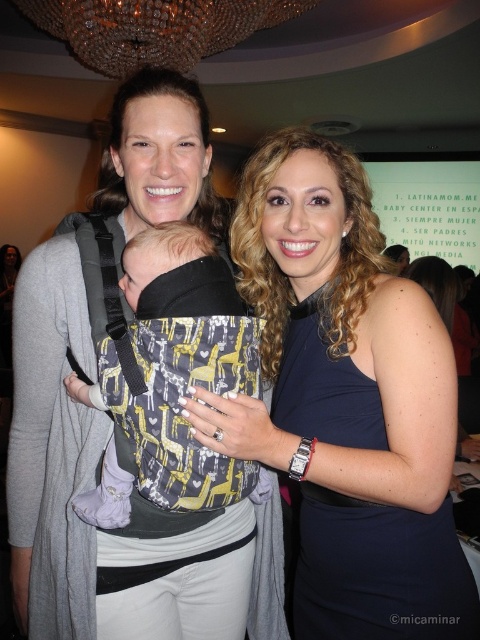
Can you confirm if matte black baby carrier at center is bigger than printed fabric baby carrier at center?

Yes, matte black baby carrier at center is bigger than printed fabric baby carrier at center.

Which is above, matte black baby carrier at center or printed fabric baby carrier at center?

printed fabric baby carrier at center

Which is behind, point (66, 536) or point (252, 385)?

Point (66, 536)

Identify the location of matte black baby carrier at center. The image size is (480, 640). (118, 493).

Who is more distant from viewer, (421,536) or (186,340)?

The point (421,536) is more distant.

What do you see at coordinates (347, 401) in the screenshot? I see `matte black dress at center` at bounding box center [347, 401].

At what (x,y) coordinates should I click in order to perform the action: click on matte black dress at center. Please return your answer as a coordinate pair (x, y). This screenshot has width=480, height=640. Looking at the image, I should click on (347, 401).

Is matte black dress at center positioned before matte black baby carrier at center?

That is True.

Is matte black dress at center thinner than matte black baby carrier at center?

→ Correct, matte black dress at center's width is less than matte black baby carrier at center's.

Does point (440, 376) lie behind point (140, 122)?

No, it is in front of (140, 122).

This screenshot has height=640, width=480. I want to click on matte black dress at center, so click(x=347, y=401).